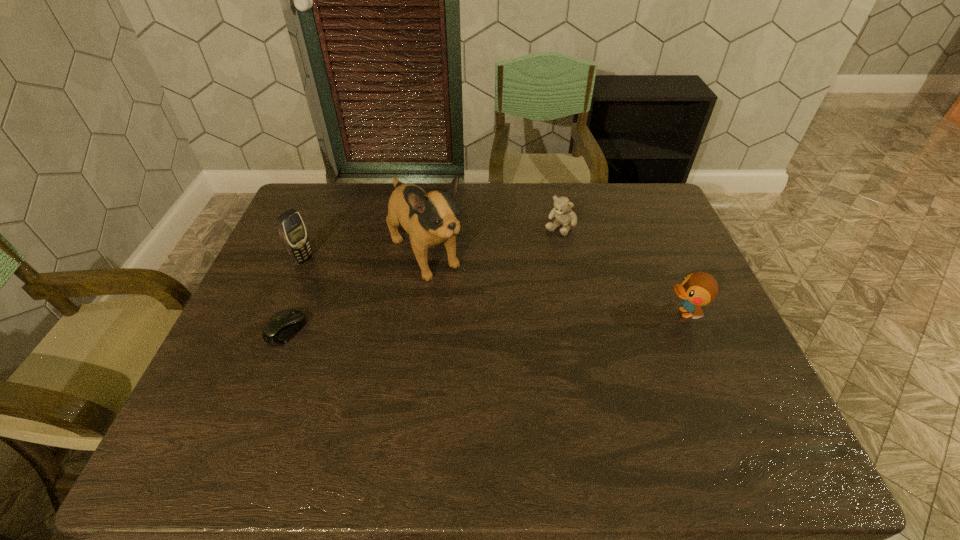
Point out which object is positioned as the nearest to the cellular telephone. Please provide its 2D coordinates. Your answer should be formatted as a tuple, i.e. [(x, y)], where the tuple contains the x and y coordinates of a point satisfying the conditions above.

[(281, 327)]

Where is `free space that satisfies the following two spatial constraints: 1. on the front side of the duck; 2. on the front-facing side of the third object from left to right`? Image resolution: width=960 pixels, height=540 pixels. free space that satisfies the following two spatial constraints: 1. on the front side of the duck; 2. on the front-facing side of the third object from left to right is located at coordinates (417, 313).